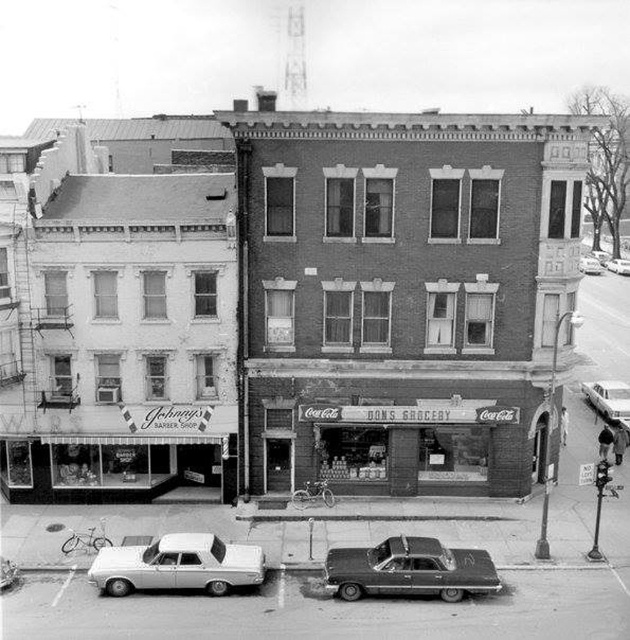
You are a delivery person trying to park a 2.5 meter wide delivery van between the shiny black car at center and the silver metallic sedan at lower center. Can you fit the van between them?

The distance between the shiny black car at center and the silver metallic sedan at lower center is 3.42 meters. Since the van is 2.5 meters wide, there is enough space to park the van between them.